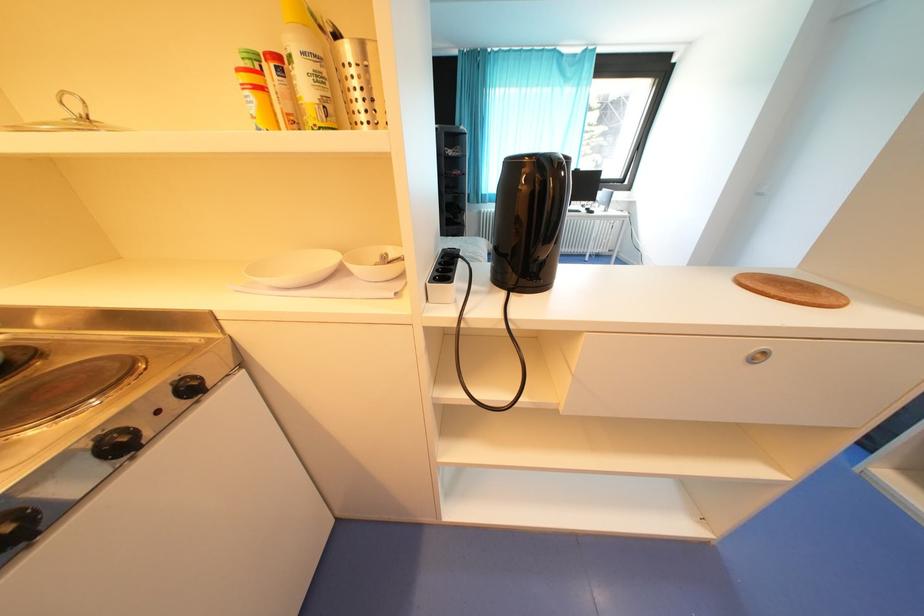
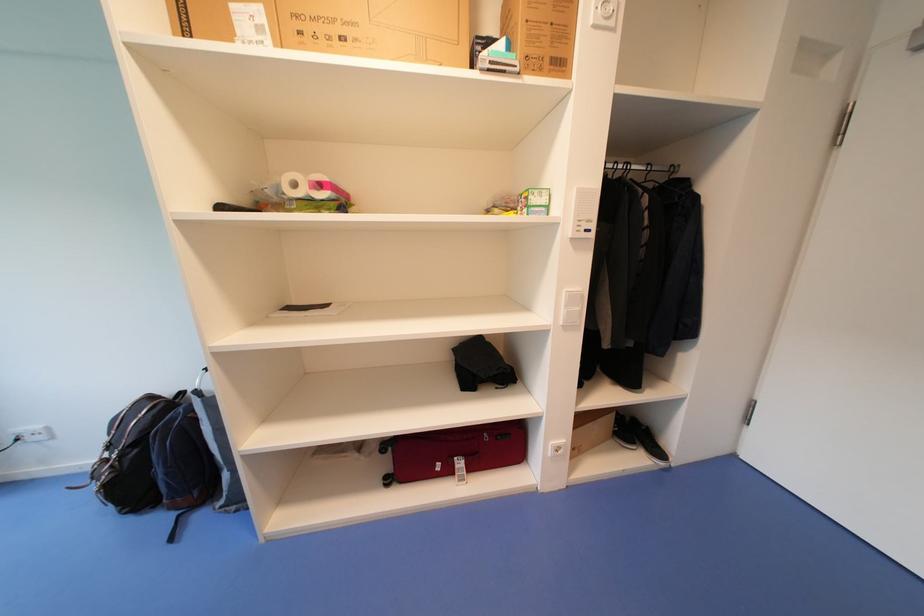
First-person continuous shooting, in which direction is the camera rotating?

The camera's rotation is toward right-down.